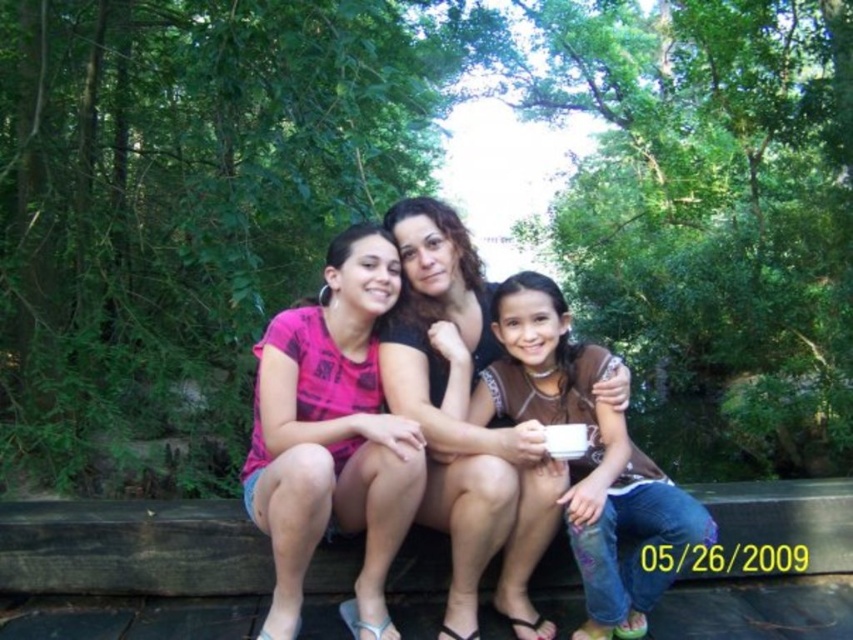
Can you confirm if pink fabric shirt at center is wider than brown matte shirt at center?

Incorrect, pink fabric shirt at center's width does not surpass brown matte shirt at center's.

Between pink fabric shirt at center and brown matte shirt at center, which one is positioned lower?

Positioned lower is brown matte shirt at center.

Who is more distant from viewer, (338,490) or (560,333)?

The point (560,333) is behind.

You are a GUI agent. You are given a task and a screenshot of the screen. Output one action in this format:
    pyautogui.click(x=<x>, y=<y>)
    Task: Click on the pink fabric shirt at center
    
    Given the screenshot: What is the action you would take?
    pyautogui.click(x=332, y=435)

Is pink fabric shirt at center positioned in front of matte black shirt at center?

Yes, it is.

Does pink fabric shirt at center have a lesser width compared to matte black shirt at center?

In fact, pink fabric shirt at center might be wider than matte black shirt at center.

Where is `pink fabric shirt at center`? pink fabric shirt at center is located at coordinates (332, 435).

Does matte black shirt at center appear over brown matte shirt at center?

Yes.

Who is taller, matte black shirt at center or brown matte shirt at center?

matte black shirt at center is taller.

The image size is (853, 640). Identify the location of matte black shirt at center. (465, 424).